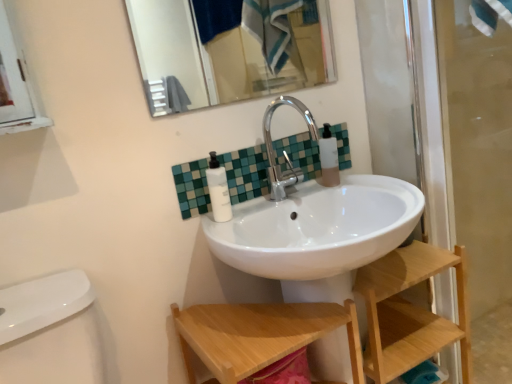
Where is `vacant area in front of translucent plastic bottle at upper right, placed as the first toiletry when sorted from right to left`? This screenshot has width=512, height=384. vacant area in front of translucent plastic bottle at upper right, placed as the first toiletry when sorted from right to left is located at coordinates pyautogui.click(x=359, y=187).